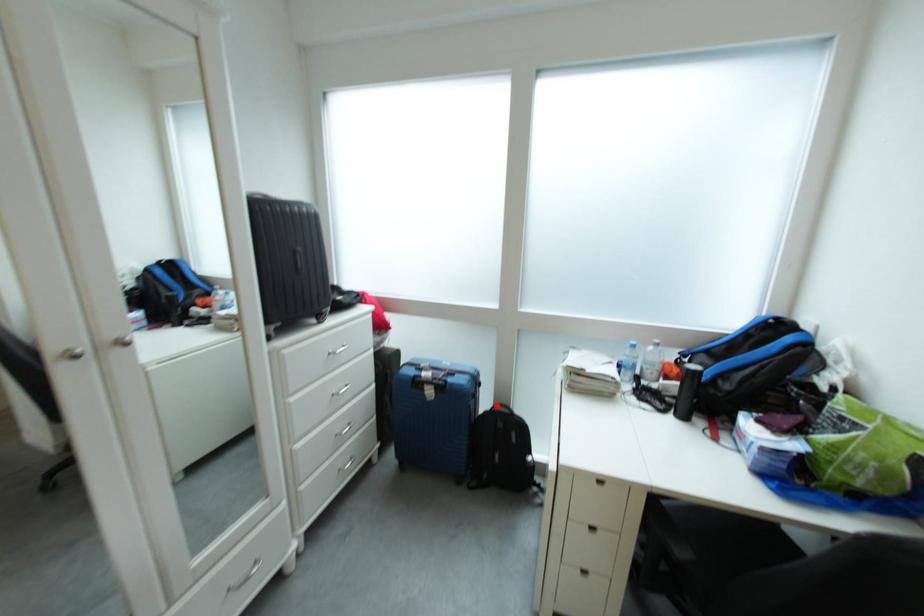
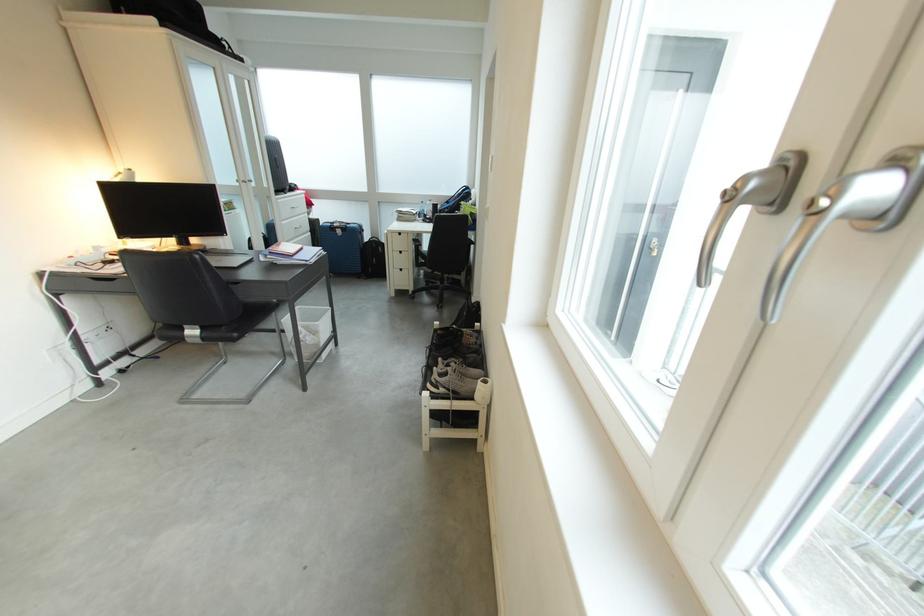
Question: I am providing you with two images of the same scene from different viewpoints. In image1, a red point is highlighted. Considering the same 3D point in image2, which of the following is correct?

Choices:
 (A) It is closer
 (B) It is farther

Answer: (A)